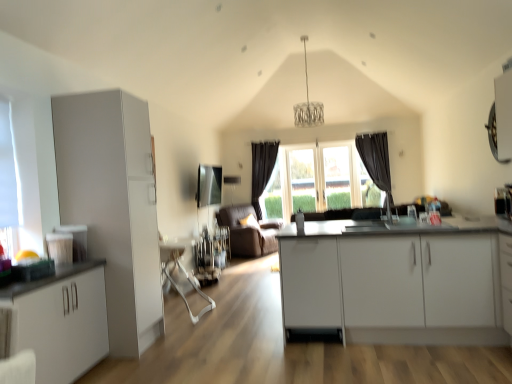
Question: Considering the relative sizes of clear glass window at center, the 1th window viewed from the right, and white matte cabinet at left, which is the 3th cabinetry from right to left, in the image provided, is clear glass window at center, the 1th window viewed from the right, shorter than white matte cabinet at left, which is the 3th cabinetry from right to left,?

Choices:
 (A) no
 (B) yes

Answer: (A)

Question: Is clear glass window at center, marked as the 3th window in a front-to-back arrangement, wider than white matte cabinet at left, which is the 3th cabinetry from right to left?

Choices:
 (A) no
 (B) yes

Answer: (A)

Question: From the image's perspective, is clear glass window at center, marked as the 3th window in a front-to-back arrangement, over white matte cabinet at left, the first cabinetry viewed from the left?

Choices:
 (A) yes
 (B) no

Answer: (A)

Question: Considering the relative sizes of clear glass window at center, marked as the 3th window in a front-to-back arrangement, and white matte cabinet at left, the first cabinetry viewed from the left, in the image provided, is clear glass window at center, marked as the 3th window in a front-to-back arrangement, thinner than white matte cabinet at left, the first cabinetry viewed from the left,?

Choices:
 (A) no
 (B) yes

Answer: (B)

Question: Is clear glass window at center, arranged as the third window when viewed from the left, bigger than white matte cabinet at left, which is the 3th cabinetry from right to left?

Choices:
 (A) yes
 (B) no

Answer: (B)

Question: Considering the relative sizes of dark fabric curtain at center, which is counted as the 1th curtain, starting from the left, and transparent glass window at center, which is the second window from right to left, in the image provided, is dark fabric curtain at center, which is counted as the 1th curtain, starting from the left, thinner than transparent glass window at center, which is the second window from right to left,?

Choices:
 (A) no
 (B) yes

Answer: (A)

Question: From a real-world perspective, is dark fabric curtain at center, which is counted as the 1th curtain, starting from the back, located higher than transparent glass window at center, which is counted as the 2th window, starting from the left?

Choices:
 (A) no
 (B) yes

Answer: (B)

Question: From the image's perspective, would you say dark fabric curtain at center, which is counted as the 1th curtain, starting from the left, is positioned over transparent glass window at center, which is counted as the second window, starting from the back?

Choices:
 (A) yes
 (B) no

Answer: (A)

Question: Considering the relative sizes of dark fabric curtain at center, the second curtain in the front-to-back sequence, and transparent glass window at center, the 2th window in the front-to-back sequence, in the image provided, is dark fabric curtain at center, the second curtain in the front-to-back sequence, taller than transparent glass window at center, the 2th window in the front-to-back sequence,?

Choices:
 (A) yes
 (B) no

Answer: (A)

Question: Is there a large distance between dark fabric curtain at center, the second curtain in the front-to-back sequence, and transparent glass window at center, which is counted as the 2th window, starting from the left?

Choices:
 (A) yes
 (B) no

Answer: (A)

Question: Is dark fabric curtain at center, the second curtain in the front-to-back sequence, positioned beyond the bounds of transparent glass window at center, which is counted as the 2th window, starting from the left?

Choices:
 (A) yes
 (B) no

Answer: (A)

Question: Is white matte cabinet at center, the first cabinetry in the right-to-left sequence, facing towards dark fabric curtain at center, the second curtain in the front-to-back sequence?

Choices:
 (A) yes
 (B) no

Answer: (B)